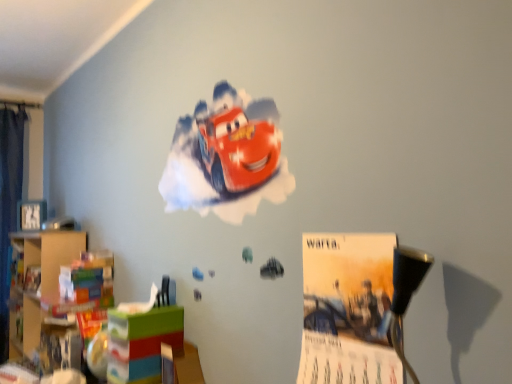
Question: Is wooden bookshelf at left facing towards matte plastic toy box at lower left?

Choices:
 (A) yes
 (B) no

Answer: (B)

Question: Can you confirm if wooden bookshelf at left is positioned to the left of matte plastic toy box at lower left?

Choices:
 (A) no
 (B) yes

Answer: (B)

Question: Is there a large distance between wooden bookshelf at left and matte plastic toy box at lower left?

Choices:
 (A) no
 (B) yes

Answer: (A)

Question: Considering the relative sizes of wooden bookshelf at left and matte plastic toy box at lower left in the image provided, is wooden bookshelf at left taller than matte plastic toy box at lower left?

Choices:
 (A) no
 (B) yes

Answer: (B)

Question: Is wooden bookshelf at left to the right of matte plastic toy box at lower left from the viewer's perspective?

Choices:
 (A) yes
 (B) no

Answer: (B)

Question: Does wooden bookshelf at left have a greater width compared to matte plastic toy box at lower left?

Choices:
 (A) no
 (B) yes

Answer: (B)

Question: Can you confirm if matte paper poster at center is thinner than matte plastic toy box at lower left?

Choices:
 (A) yes
 (B) no

Answer: (A)

Question: Can you confirm if matte paper poster at center is taller than matte plastic toy box at lower left?

Choices:
 (A) no
 (B) yes

Answer: (B)

Question: Is matte paper poster at center oriented towards matte plastic toy box at lower left?

Choices:
 (A) yes
 (B) no

Answer: (B)

Question: From a real-world perspective, is matte paper poster at center under matte plastic toy box at lower left?

Choices:
 (A) yes
 (B) no

Answer: (B)

Question: Does matte paper poster at center appear on the left side of matte plastic toy box at lower left?

Choices:
 (A) yes
 (B) no

Answer: (B)

Question: Considering the relative sizes of matte paper poster at center and matte plastic toy box at lower left in the image provided, is matte paper poster at center shorter than matte plastic toy box at lower left?

Choices:
 (A) yes
 (B) no

Answer: (B)

Question: Considering the relative sizes of matte plastic toy box at lower left and wooden bookshelf at left in the image provided, is matte plastic toy box at lower left shorter than wooden bookshelf at left?

Choices:
 (A) yes
 (B) no

Answer: (A)